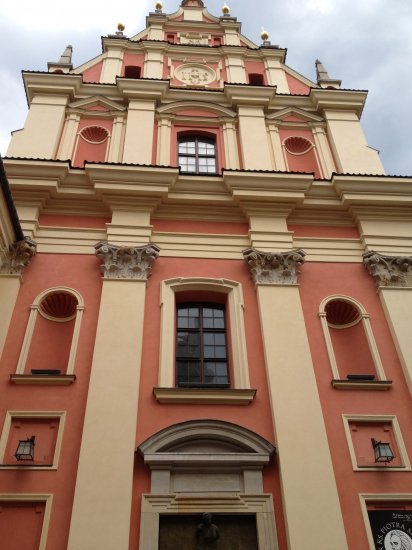
The height and width of the screenshot is (550, 412). I want to click on light, so click(385, 454), click(27, 450).